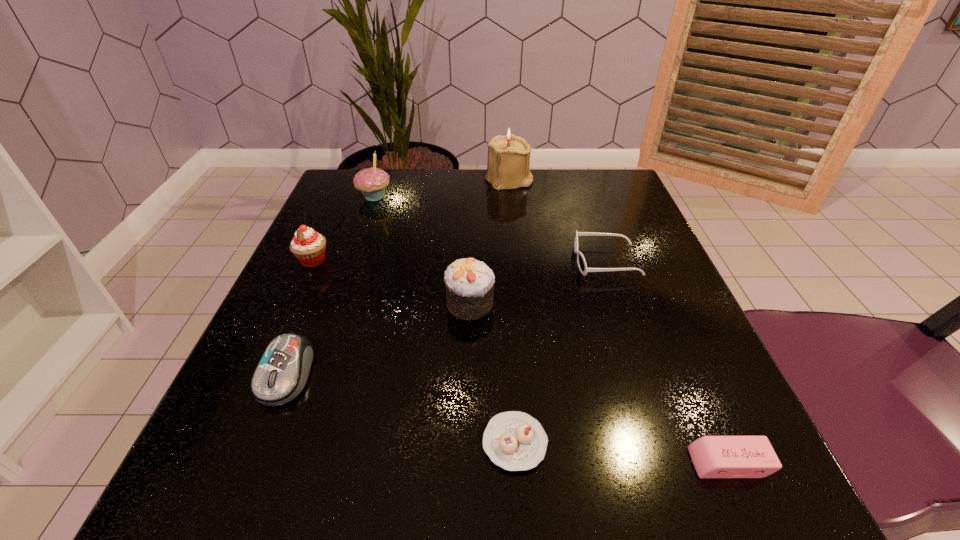
Identify the location of vacant space at the left edge of the desktop. This screenshot has width=960, height=540. (379, 245).

The height and width of the screenshot is (540, 960). In the image, there is a desktop. Find the location of `blank space at the right edge`. blank space at the right edge is located at coordinates (702, 366).

Where is `vacant space at the far left corner of the desktop`? vacant space at the far left corner of the desktop is located at coordinates (348, 198).

Image resolution: width=960 pixels, height=540 pixels. In the image, there is a desktop. In order to click on vacant space at the near left corner in this screenshot , I will do `click(225, 500)`.

Image resolution: width=960 pixels, height=540 pixels. I want to click on vacant space at the far right corner, so point(563,186).

Locate an element on the screen. The width and height of the screenshot is (960, 540). empty location between the sixth tallest object and the fifth farthest object is located at coordinates (538, 282).

Image resolution: width=960 pixels, height=540 pixels. Find the location of `free space between the third cupcake from right to left and the leftmost cupcake`. free space between the third cupcake from right to left and the leftmost cupcake is located at coordinates (344, 228).

Find the location of a particular element. vacant space that is in between the third shortest object and the eraser is located at coordinates (667, 362).

This screenshot has height=540, width=960. Identify the location of free space between the tallest cupcake and the sunglasses. (490, 229).

This screenshot has height=540, width=960. Identify the location of empty space between the third farthest cupcake and the computer mouse. (378, 339).